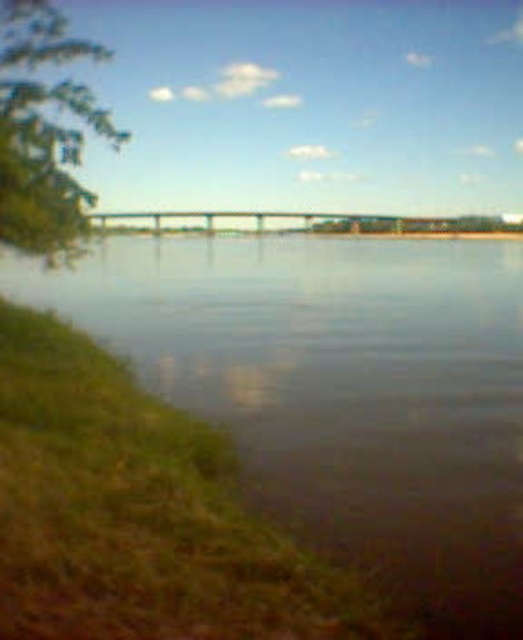
Question: Among these objects, which one is nearest to the camera?

Choices:
 (A) green leafy tree at left
 (B) green metallic bridge at center

Answer: (A)

Question: Does green leafy tree at left appear on the right side of green metallic bridge at center?

Choices:
 (A) yes
 (B) no

Answer: (A)

Question: Which point is closer to the camera taking this photo?

Choices:
 (A) pos(445,428)
 (B) pos(44,189)

Answer: (A)

Question: Which object is farther from the camera taking this photo?

Choices:
 (A) brown reflective water at center
 (B) green metallic bridge at center

Answer: (B)

Question: Is green leafy tree at left wider than green metallic bridge at center?

Choices:
 (A) no
 (B) yes

Answer: (A)

Question: Can you confirm if brown reflective water at center is thinner than green metallic bridge at center?

Choices:
 (A) no
 (B) yes

Answer: (B)